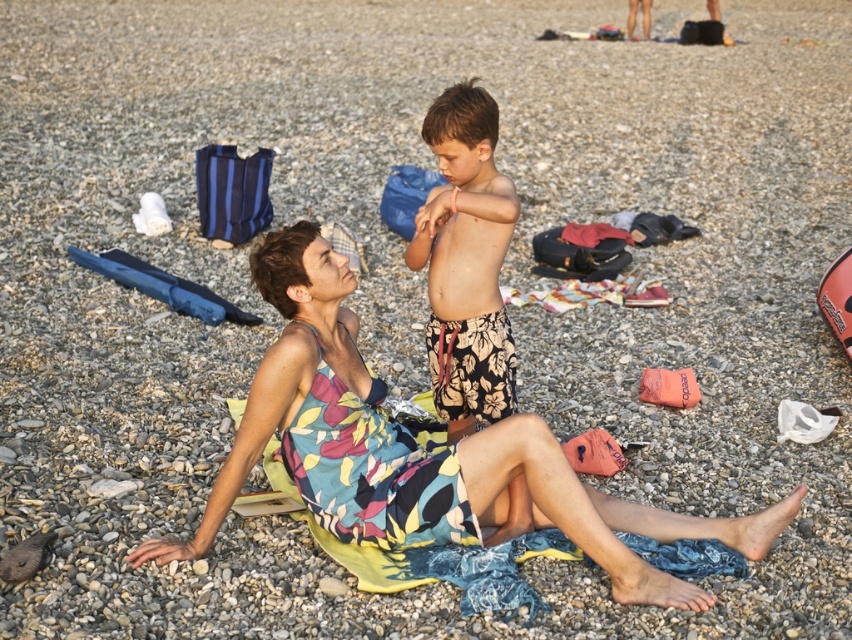
You are a photographer trying to capture a candid shot of the two people on the beach. You want to ensure both the floral dress at center and the floral swim trunks at center are visible in the frame. Based on their positions, which one should you focus on first to ensure they are both in the shot?

You should focus on the floral swim trunks at center first because the floral dress at center is to the right of it, so positioning the frame to include the swim trunks ensures the dress will also be captured to its right.

You are a photographer trying to capture a candid shot of both the floral dress at center and the floral swim trunks at center. Since you want to ensure both subjects are in focus, you need to know which one is taller. Can you determine which is taller?

The floral swim trunks at center are taller than the floral dress at center, so you should adjust your camera settings to focus on the taller subject first.